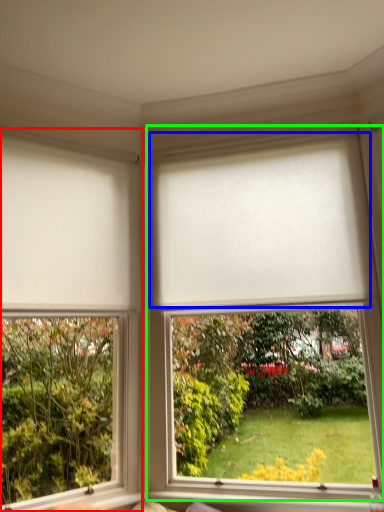
Question: Considering the real-world distances, which object is farthest from window (highlighted by a red box)? blind (highlighted by a blue box) or window (highlighted by a green box)?

Choices:
 (A) blind
 (B) window

Answer: (A)